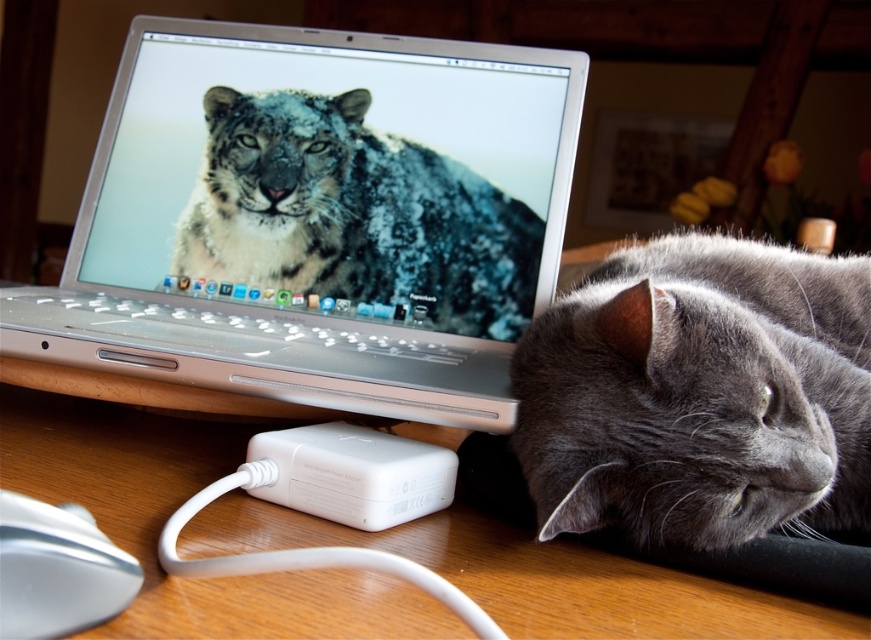
You are organizing a desk and want to stack the silver metallic laptop at upper left on top of the white plastic power adapter at lower center. Is this possible based on their sizes?

The silver metallic laptop at upper left is much taller than the white plastic power adapter at lower center, so stacking the laptop on top of the adapter would not be possible due to the laptop being significantly larger in height.

You are a delivery robot trying to place a package on the desk. The package must be placed at point (699, 394). The gray soft fur cat at right is currently on the desk. Can you place the package there without disturbing the cat?

The point (699, 394) corresponds to the gray soft fur cat at right, so placing the package there would require moving the cat, which might disturb it. Choose another location on the desk.

You are a photographer aiming to capture the gray soft fur cat at right in a closeup shot. To do this, you need to position your camera precisely. Based on the scene, what are the coordinates where you should focus your camera to ensure the cat is centered in the frame?

The gray soft fur cat at right is located at coordinates point (699, 394), so you should focus your camera at those coordinates to center the cat in the frame.